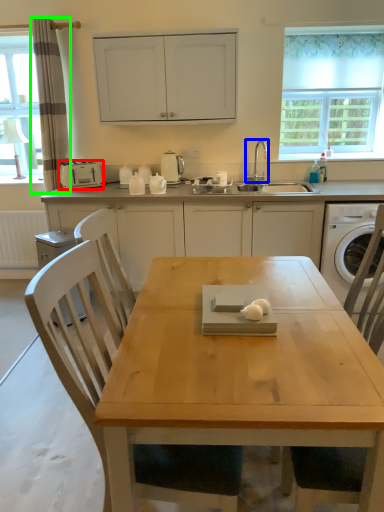
Question: Based on their relative distances, which object is nearer to kitchen appliance (highlighted by a red box)? Choose from tap (highlighted by a blue box) and curtain (highlighted by a green box).

Choices:
 (A) tap
 (B) curtain

Answer: (B)